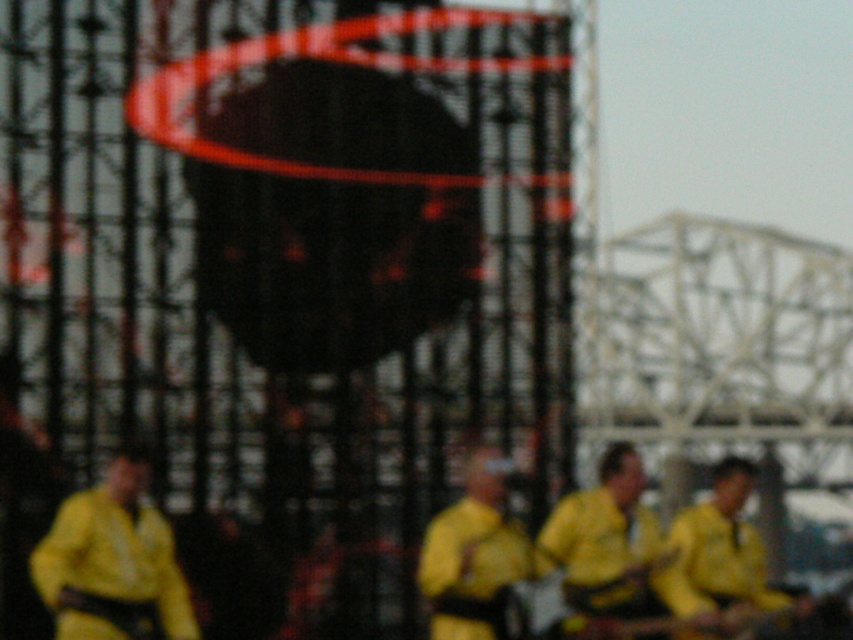
Can you confirm if yellow matte jacket at lower left is positioned to the right of yellow matte shirt at center?

Incorrect, yellow matte jacket at lower left is not on the right side of yellow matte shirt at center.

In the scene shown: Measure the distance from yellow matte jacket at lower left to yellow matte shirt at center.

yellow matte jacket at lower left is 39.00 feet away from yellow matte shirt at center.

This screenshot has height=640, width=853. Identify the location of yellow matte jacket at lower left. (113, 563).

Does yellow matte shirt at center appear over yellow matte uniform at center?

No, yellow matte shirt at center is not above yellow matte uniform at center.

Identify the location of yellow matte shirt at center. (474, 554).

Image resolution: width=853 pixels, height=640 pixels. What are the coordinates of `yellow matte shirt at center` in the screenshot? It's located at (474, 554).

Is yellow matte guitar at center positioned before yellow matte shirt at center?

Yes, it is.

Which is in front, point (637, 616) or point (488, 515)?

Point (637, 616) is more forward.

This screenshot has width=853, height=640. Identify the location of yellow matte guitar at center. (607, 541).